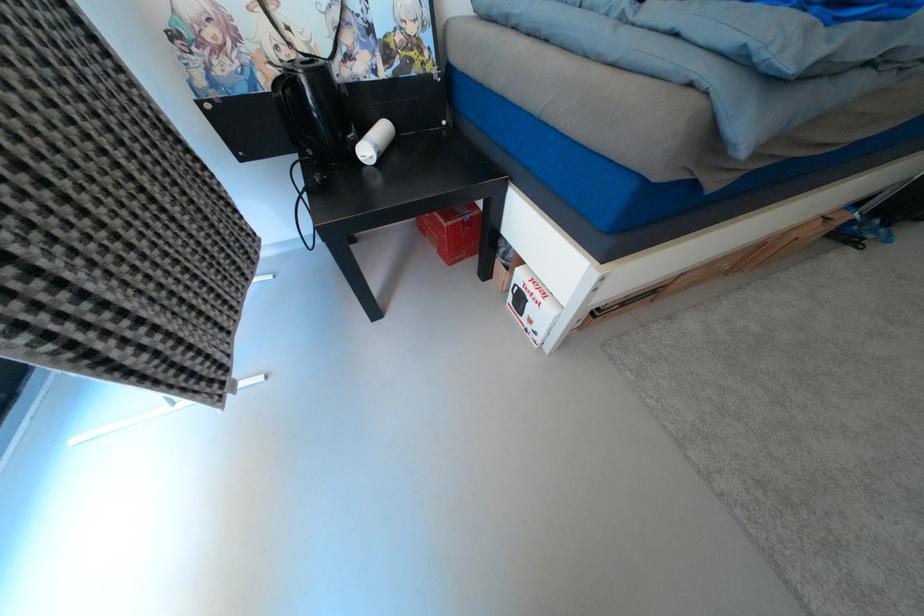
What are the coordinates of `black kettle handle` in the screenshot? It's located at (287, 108).